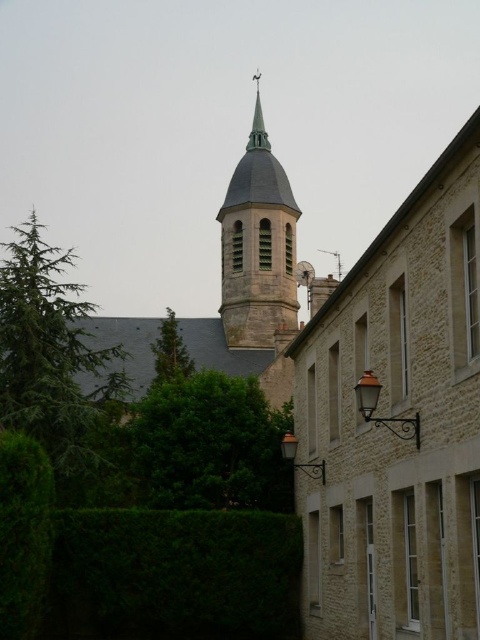
Question: Can you confirm if smooth gray steeple at upper left is smaller than smooth copper spire at upper center?

Choices:
 (A) yes
 (B) no

Answer: (B)

Question: Among these points, which one is farthest from the camera?

Choices:
 (A) (17, 570)
 (B) (334, 307)

Answer: (B)

Question: Based on their relative distances, which object is nearer to the green textured tree at center?

Choices:
 (A) smooth gray steeple at upper left
 (B) green needle-like tree at left

Answer: (B)

Question: Is green needle-like tree at left thinner than smooth copper spire at upper center?

Choices:
 (A) yes
 (B) no

Answer: (B)

Question: Is dark green hedge at lower center to the left of green leafy hedge at lower left from the viewer's perspective?

Choices:
 (A) yes
 (B) no

Answer: (B)

Question: Among these objects, which one is nearest to the camera?

Choices:
 (A) green leafy hedge at lower left
 (B) green needle-like tree at left

Answer: (A)